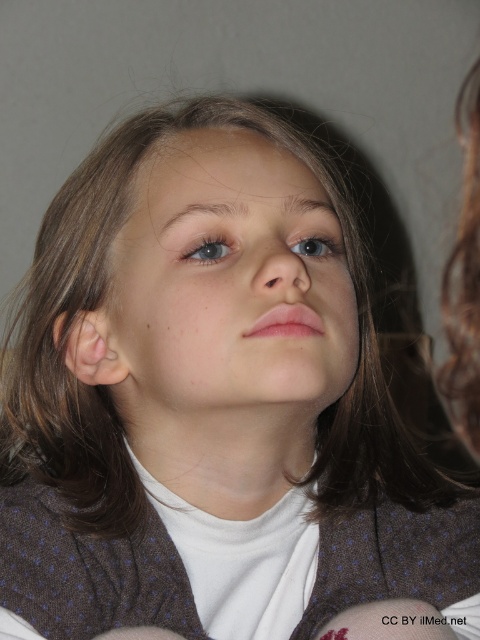
You are an artist sketching the person in the image. You notice two points on their face at coordinates point (314, 246) and point (303, 252). Which point is closer to your eyes?

Point (314, 246) is further to the viewer than point (303, 252), so the point closer to your eyes is point (314, 246).

You are a photographer adjusting the focus on your camera. You want to ensure both the smooth skin face at center and the blue matte eye at center are in sharp focus. Given that your camera has a depth of field that can cover 2.5 inches, will both elements be in focus?

The smooth skin face at center and the blue matte eye at center are 2.45 inches apart from each other. Since the depth of field can cover 2.5 inches, both elements will be in focus.